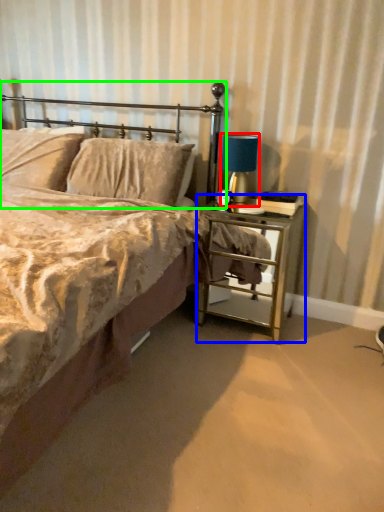
Question: Based on their relative distances, which object is nearer to bedside lamp (highlighted by a red box)? Choose from nightstand (highlighted by a blue box) and headboard (highlighted by a green box).

Choices:
 (A) nightstand
 (B) headboard

Answer: (B)